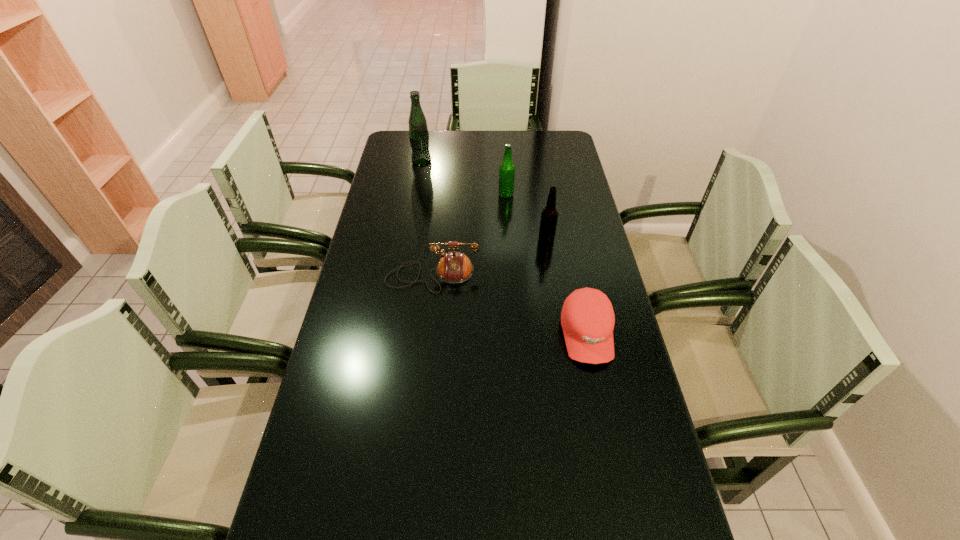
This screenshot has width=960, height=540. Identify the location of free space located 0.320m on the label of the second beer bottle from right to left. (414, 194).

Find the location of a particular element. The image size is (960, 540). free point located 0.270m on the label of the second beer bottle from right to left is located at coordinates (426, 194).

You are a GUI agent. You are given a task and a screenshot of the screen. Output one action in this format:
    pyautogui.click(x=<x>, y=<y>)
    Task: Click on the free spot located on the label of the second beer bottle from right to left
    The width and height of the screenshot is (960, 540).
    Given the screenshot: What is the action you would take?
    pyautogui.click(x=443, y=194)

At what (x,y) coordinates should I click in order to perform the action: click on vacant space situated 0.080m on the rotary dial of the telephone. Please return your answer as a coordinate pair (x, y). Looking at the image, I should click on (428, 315).

What are the coordinates of `vacant space situated 0.290m on the front-facing side of the cap` in the screenshot? It's located at (618, 488).

Find the location of a particular element. object that is at the far edge is located at coordinates (418, 131).

Find the location of a particular element. The image size is (960, 540). beer bottle at the left edge is located at coordinates (418, 131).

Identify the location of telephone located in the left edge section of the desktop. (454, 267).

Find the location of a particular element. beer bottle that is positioned at the right edge is located at coordinates (549, 215).

Where is `cap that is positioned at the right edge`? The height and width of the screenshot is (540, 960). cap that is positioned at the right edge is located at coordinates (587, 317).